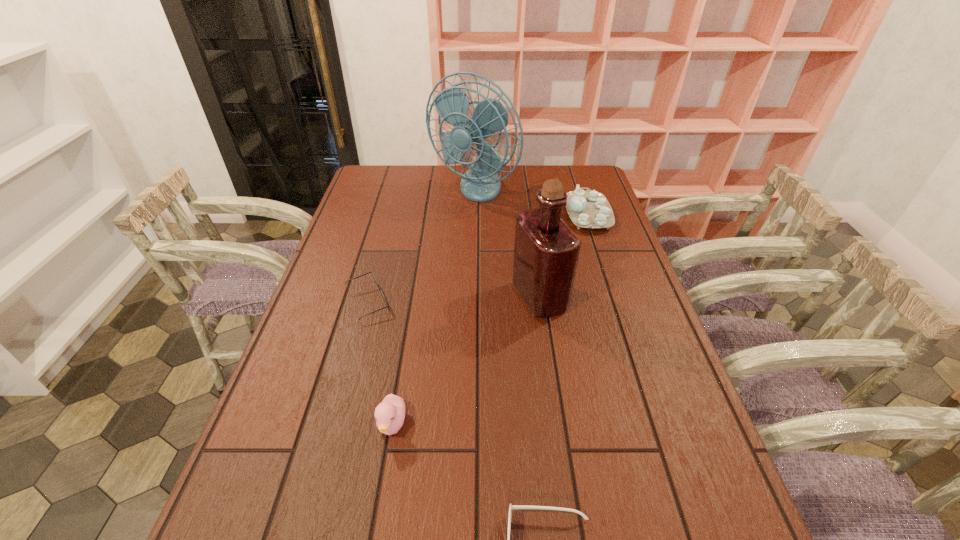
You are a GUI agent. You are given a task and a screenshot of the screen. Output one action in this format:
    pyautogui.click(x=<x>, y=<y>)
    Task: Click on the vacant space located on the front-facing side of the third shortest object
    The width and height of the screenshot is (960, 540).
    Given the screenshot: What is the action you would take?
    pyautogui.click(x=379, y=503)

Identify the location of vacant region located with the lenses facing outward on the spectacles. [x=473, y=302].

Where is `object at the far edge`? Image resolution: width=960 pixels, height=540 pixels. object at the far edge is located at coordinates (481, 183).

Identify the location of object at the left edge. The width and height of the screenshot is (960, 540). (380, 290).

You are a GUI agent. You are given a task and a screenshot of the screen. Output one action in this format:
    pyautogui.click(x=<x>, y=<y>)
    Task: Click on the object that is at the right edge
    
    Given the screenshot: What is the action you would take?
    tap(590, 209)

Find the location of `blank area at the far edge`. blank area at the far edge is located at coordinates (419, 165).

Where is `vacant region at the left edge of the desktop`? Image resolution: width=960 pixels, height=540 pixels. vacant region at the left edge of the desktop is located at coordinates (302, 366).

Locate an element on the screen. free location at the right edge is located at coordinates (707, 460).

Where is `vacant space at the far left corner of the desktop`? The width and height of the screenshot is (960, 540). vacant space at the far left corner of the desktop is located at coordinates (382, 173).

In the image, there is a desktop. Identify the location of vacant space at the far right corner. This screenshot has width=960, height=540. (558, 173).